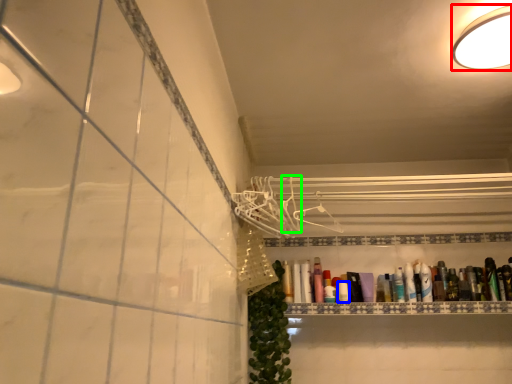
Question: Estimate the real-world distances between objects in this image. Which object is closer to light fixture (highlighted by a red box), toiletry (highlighted by a blue box) or hanger (highlighted by a green box)?

Choices:
 (A) toiletry
 (B) hanger

Answer: (B)